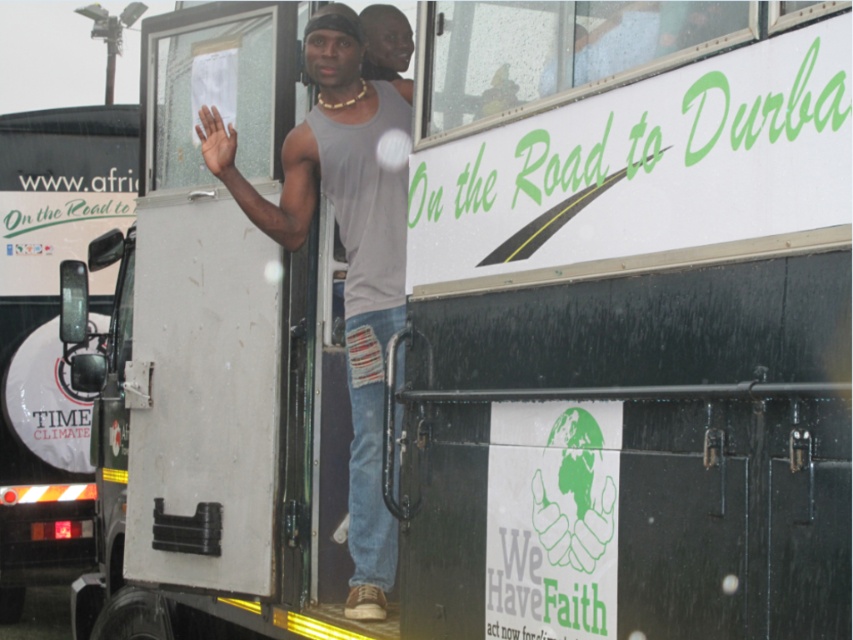
Between point (51, 445) and point (404, 216), which one is positioned behind?

The point (51, 445) is more distant.

Can you confirm if white matte truck at left is shorter than gray matte tank top at center?

In fact, white matte truck at left may be taller than gray matte tank top at center.

Where is `white matte truck at left`? The width and height of the screenshot is (853, 640). white matte truck at left is located at coordinates tap(49, 330).

Identify the location of matte gray tank top at center. The image size is (853, 640). (386, 45).

Is gray matte tank top at center to the right of light brown skin at upper center from the viewer's perspective?

Yes, gray matte tank top at center is to the right of light brown skin at upper center.

Between point (383, 196) and point (210, 109), which one is positioned behind?

The point (383, 196) is more distant.

Does point (305, 227) come behind point (209, 150)?

That is True.

At what (x,y) coordinates should I click in order to perform the action: click on gray matte tank top at center. Please return your answer as a coordinate pair (x, y). Image resolution: width=853 pixels, height=640 pixels. Looking at the image, I should click on (349, 259).